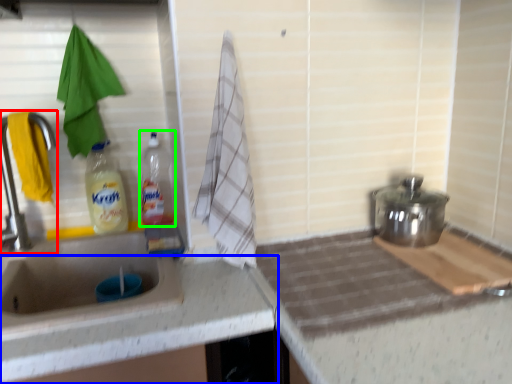
Question: Which object is positioned farthest from tap (highlighted by a red box)? Select from countertop (highlighted by a blue box) and bottle (highlighted by a green box).

Choices:
 (A) countertop
 (B) bottle

Answer: (A)